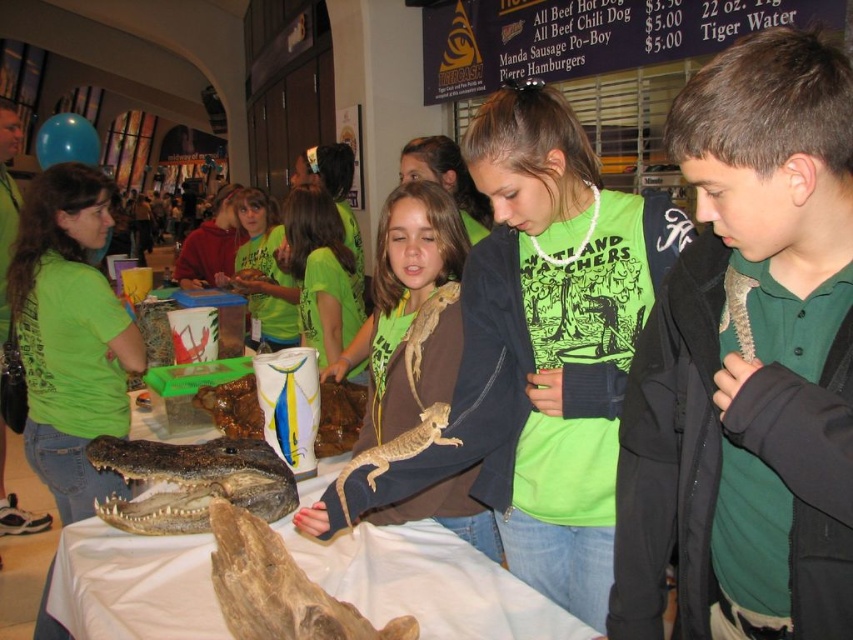
Is brown matte lizard at center closer to the viewer compared to smooth beige lizard at center?

That is False.

Which is in front, point (431, 250) or point (454, 440)?

Point (454, 440) is in front.

Which is in front, point (433, 296) or point (370, 456)?

Point (370, 456) is more forward.

At what (x,y) coordinates should I click in order to perform the action: click on brown matte lizard at center. Please return your answer as a coordinate pair (x, y). Looking at the image, I should click on (410, 310).

Based on the photo, can you confirm if green textured shirt at center is thinner than dark brown textured crocodile head at center?

Yes.

Which is behind, point (698, 433) or point (143, 532)?

The point (143, 532) is more distant.

Is point (689, 93) positioned after point (173, 468)?

No.

The width and height of the screenshot is (853, 640). I want to click on green textured shirt at center, so click(x=747, y=362).

Describe the element at coordinates (410, 310) in the screenshot. This screenshot has width=853, height=640. I see `brown matte lizard at center` at that location.

Does brown matte lizard at center appear under dark brown textured crocodile head at center?

No.

The image size is (853, 640). What do you see at coordinates (410, 310) in the screenshot?
I see `brown matte lizard at center` at bounding box center [410, 310].

This screenshot has width=853, height=640. What are the coordinates of `brown matte lizard at center` in the screenshot? It's located at (410, 310).